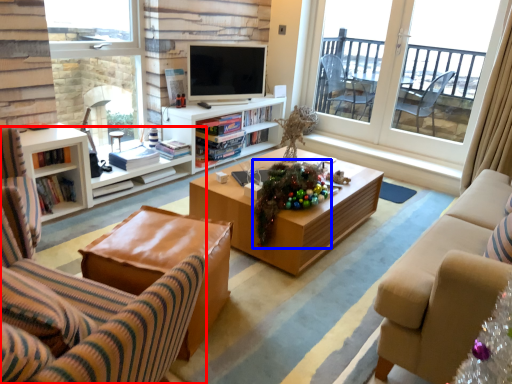
Question: Which object appears closest to the camera in this image, chair (highlighted by a red box) or christmas decoration (highlighted by a blue box)?

Choices:
 (A) chair
 (B) christmas decoration

Answer: (A)